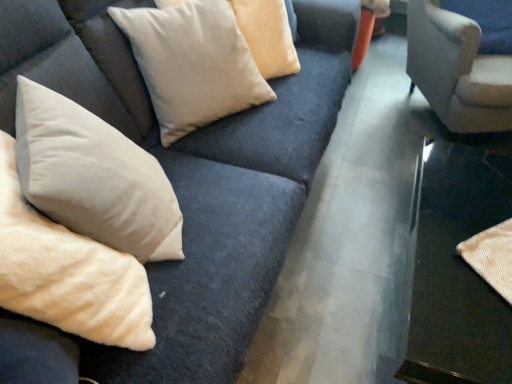
Question: Is velvet beige pillows at upper left smaller than white soft pillow at lower left, the 1th pillow from the front?

Choices:
 (A) no
 (B) yes

Answer: (B)

Question: Is the depth of velvet beige pillows at upper left greater than that of white soft pillow at lower left, the second pillow viewed from the back?

Choices:
 (A) no
 (B) yes

Answer: (B)

Question: Does velvet beige pillows at upper left have a greater width compared to white soft pillow at lower left, the 1th pillow from the front?

Choices:
 (A) no
 (B) yes

Answer: (B)

Question: Is velvet beige pillows at upper left directly adjacent to white soft pillow at lower left, the 1th pillow from the front?

Choices:
 (A) yes
 (B) no

Answer: (B)

Question: Is white soft pillow at lower left, the second pillow viewed from the back, at the back of velvet beige pillows at upper left?

Choices:
 (A) yes
 (B) no

Answer: (A)

Question: Could you tell me if velvet beige pillows at upper left is turned towards white soft pillow at lower left, the second pillow viewed from the back?

Choices:
 (A) no
 (B) yes

Answer: (B)

Question: From the image's perspective, does velvet beige pillows at upper left appear lower than metallic silver table at lower right?

Choices:
 (A) yes
 (B) no

Answer: (B)

Question: Is the surface of velvet beige pillows at upper left in direct contact with metallic silver table at lower right?

Choices:
 (A) no
 (B) yes

Answer: (A)

Question: Considering the relative sizes of velvet beige pillows at upper left and metallic silver table at lower right in the image provided, is velvet beige pillows at upper left taller than metallic silver table at lower right?

Choices:
 (A) no
 (B) yes

Answer: (B)

Question: Is velvet beige pillows at upper left wider than metallic silver table at lower right?

Choices:
 (A) no
 (B) yes

Answer: (A)

Question: Does velvet beige pillows at upper left have a larger size compared to metallic silver table at lower right?

Choices:
 (A) yes
 (B) no

Answer: (A)

Question: Can metallic silver table at lower right be found inside velvet beige pillows at upper left?

Choices:
 (A) no
 (B) yes

Answer: (A)

Question: From the image's perspective, is suede-like beige pillow at upper center, the first pillow viewed from the back, on velvet beige pillows at upper left?

Choices:
 (A) no
 (B) yes

Answer: (B)